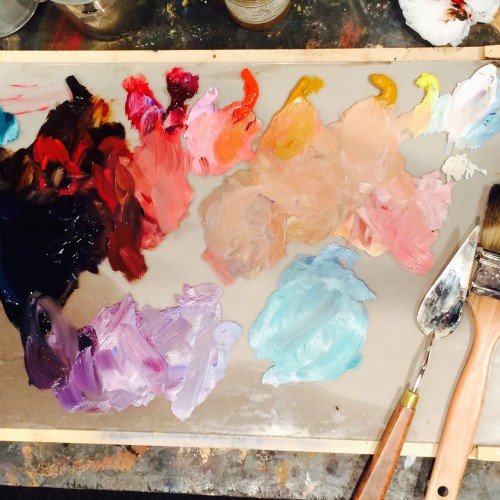
Locate an element on the screen. Image resolution: width=500 pixels, height=500 pixels. yellow paint is located at coordinates (427, 80).